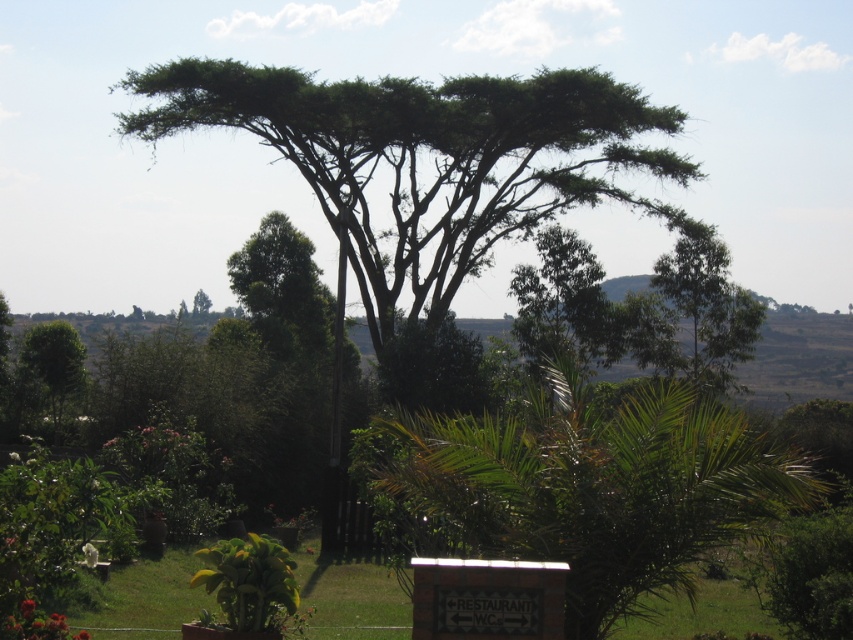
Is green leafy tree at center positioned at the back of green leafy palm at center?

Yes, it is behind green leafy palm at center.

Is point (368, 124) positioned before point (799, 480)?

No, it is behind (799, 480).

Is point (556, 72) farther from camera compared to point (614, 420)?

Yes, it is behind point (614, 420).

Identify the location of green leafy tree at center. The image size is (853, 640). (426, 170).

Is green leafy tree at center to the left of green leafy tree at upper center from the viewer's perspective?

In fact, green leafy tree at center is to the right of green leafy tree at upper center.

Find the location of `green leafy tree at center`. green leafy tree at center is located at coordinates (426, 170).

Locate an element on the screen. green leafy tree at center is located at coordinates (426, 170).

Does green leafy tree at center come behind green leafy tree at left?

Yes, it is.

Who is lower down, green leafy tree at center or green leafy tree at left?

green leafy tree at left is lower down.

Locate an element on the screen. The image size is (853, 640). green leafy tree at center is located at coordinates (426, 170).